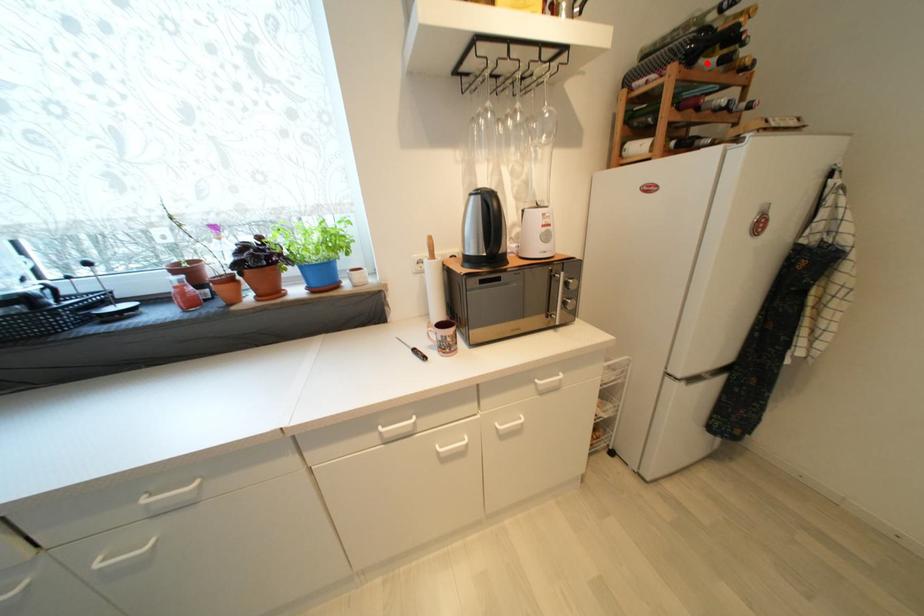
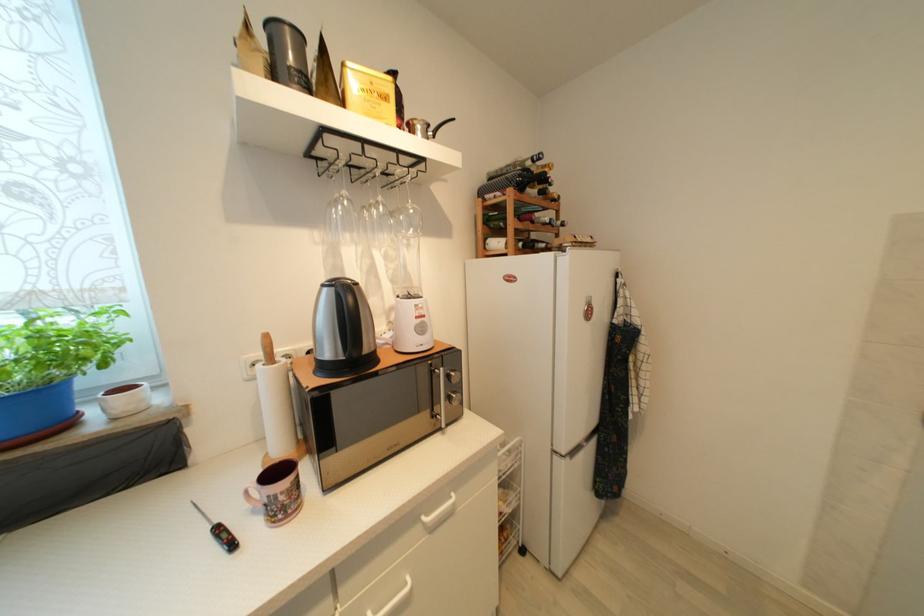
Find the pixel in the second image that matches the highlighted location in the first image.

(533, 192)